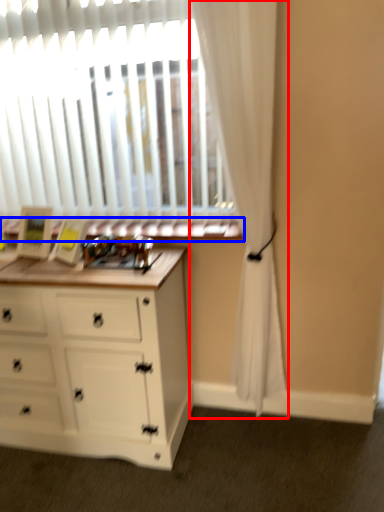
Question: Which of the following is the closest to the observer, curtain (highlighted by a red box) or window sill (highlighted by a blue box)?

Choices:
 (A) curtain
 (B) window sill

Answer: (A)